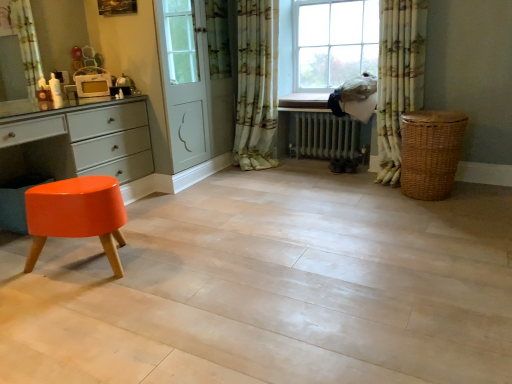
At what (x,y) coordinates should I click in order to perform the action: click on vacant space underneath orange glossy stool at lower left (from a real-world perspective). Please return your answer as a coordinate pair (x, y). The height and width of the screenshot is (384, 512). Looking at the image, I should click on (95, 274).